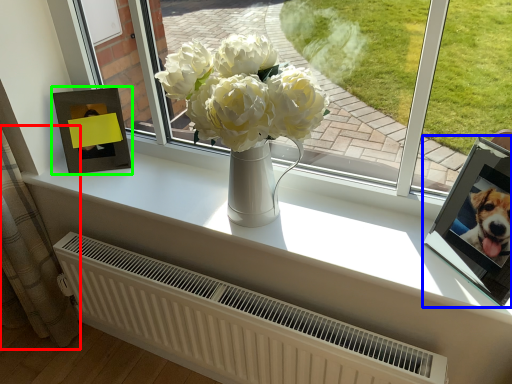
Question: Which is farther away from curtain (highlighted by a red box)? picture frame (highlighted by a blue box) or picture frame (highlighted by a green box)?

Choices:
 (A) picture frame
 (B) picture frame

Answer: (A)